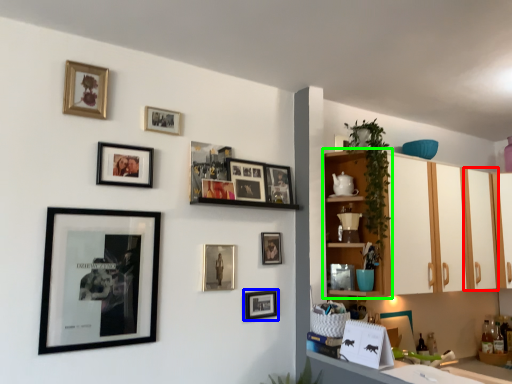
Question: Considering the real-world distances, which object is farthest from cabinetry (highlighted by a red box)? picture frame (highlighted by a blue box) or shelf (highlighted by a green box)?

Choices:
 (A) picture frame
 (B) shelf

Answer: (A)